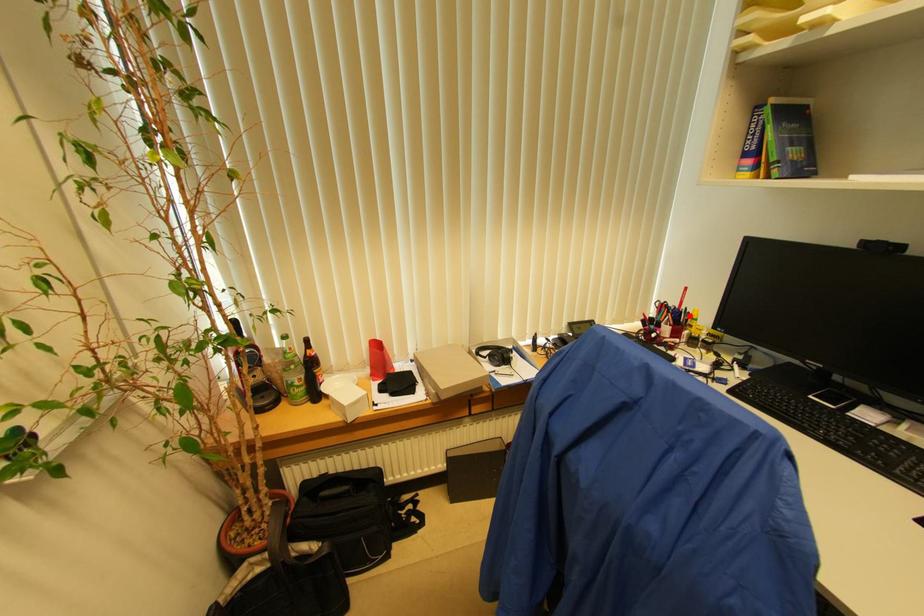
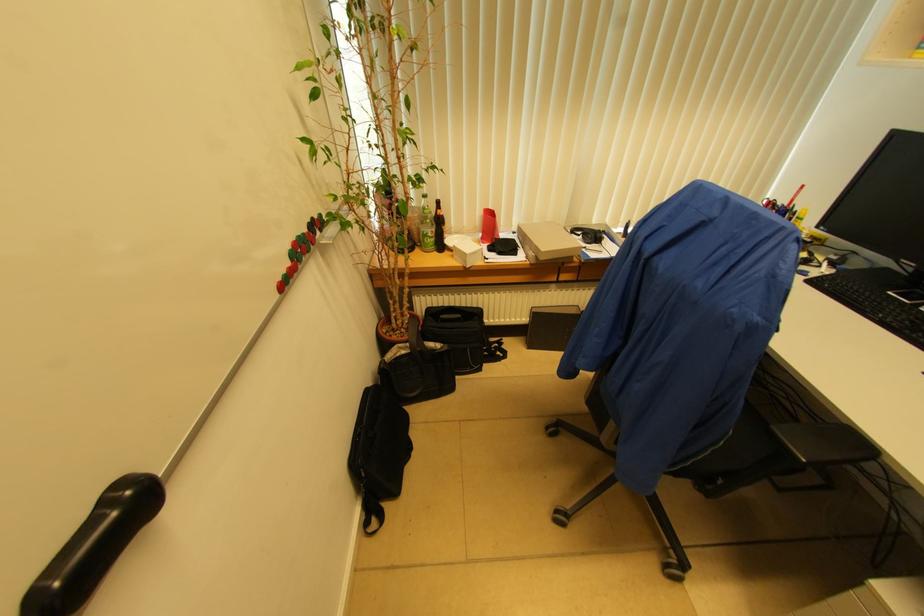
Question: A red point is marked in image1. In image2, is the corresponding 3D point closer to the camera or farther? Reply with the corresponding letter.

Choices:
 (A) The corresponding 3D point is closer.
 (B) The corresponding 3D point is farther.

Answer: (B)